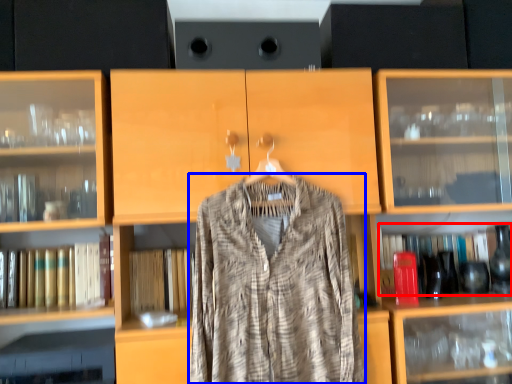
Question: Among these objects, which one is farthest to the camera, book (highlighted by a red box) or fancy dress (highlighted by a blue box)?

Choices:
 (A) book
 (B) fancy dress

Answer: (A)